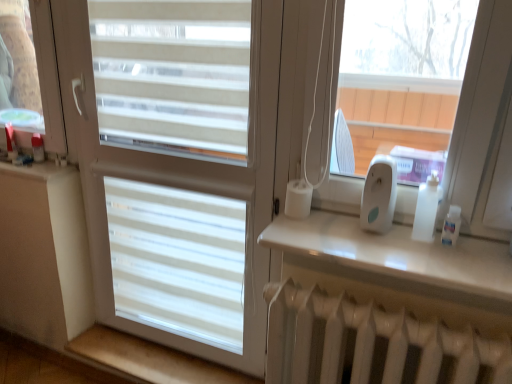
Where is `vacant space in white matte window at center (from a real-world perspective)`? vacant space in white matte window at center (from a real-world perspective) is located at coordinates (178, 355).